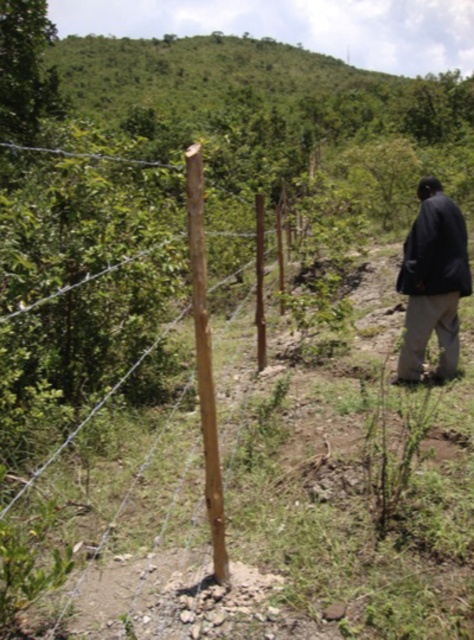
Which is below, brown rough wood post at center or dark blue jacket at lower right?

dark blue jacket at lower right is below.

Is brown rough wood post at center thinner than dark blue jacket at lower right?

Incorrect, brown rough wood post at center's width is not less than dark blue jacket at lower right's.

Which is in front, point (208, 440) or point (450, 244)?

Point (208, 440) is in front.

Find the location of `brown rough wood post at center`. brown rough wood post at center is located at coordinates (198, 368).